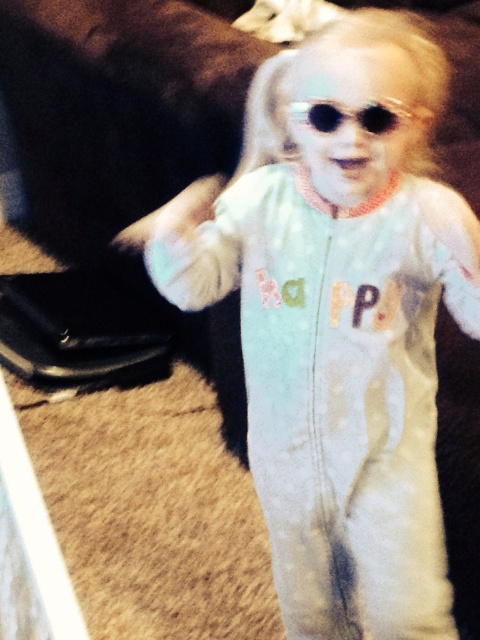
Question: Which point is farther to the camera?

Choices:
 (A) (338, 106)
 (B) (393, 92)

Answer: (B)

Question: Can you confirm if white soft onesie at center is thinner than sunglasses at center?

Choices:
 (A) yes
 (B) no

Answer: (B)

Question: Which object appears closest to the camera in this image?

Choices:
 (A) sunglasses at center
 (B) white soft onesie at center

Answer: (A)

Question: Can you confirm if white soft onesie at center is thinner than sunglasses at center?

Choices:
 (A) no
 (B) yes

Answer: (A)

Question: Which point is closer to the camera?

Choices:
 (A) white soft onesie at center
 (B) sunglasses at center

Answer: (B)

Question: Can you confirm if white soft onesie at center is positioned below sunglasses at center?

Choices:
 (A) no
 (B) yes

Answer: (B)